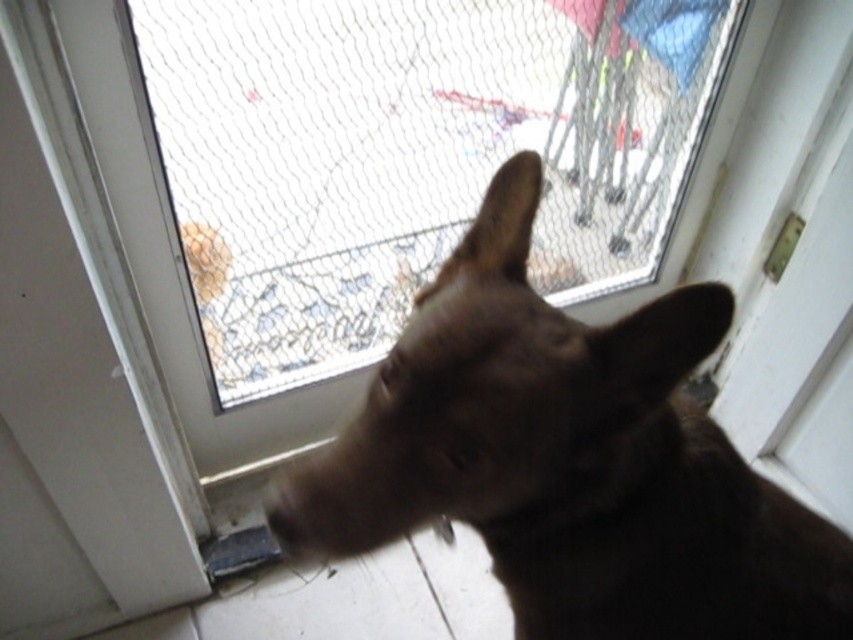
Does transparent mesh at upper center have a lesser height compared to brown fur dog at center?

Incorrect, transparent mesh at upper center's height does not fall short of brown fur dog at center's.

Is transparent mesh at upper center above brown fur dog at center?

Correct, transparent mesh at upper center is located above brown fur dog at center.

Is point (312, 234) closer to camera compared to point (532, 376)?

No, it is behind (532, 376).

Where is `transparent mesh at upper center`? Image resolution: width=853 pixels, height=640 pixels. transparent mesh at upper center is located at coordinates (409, 154).